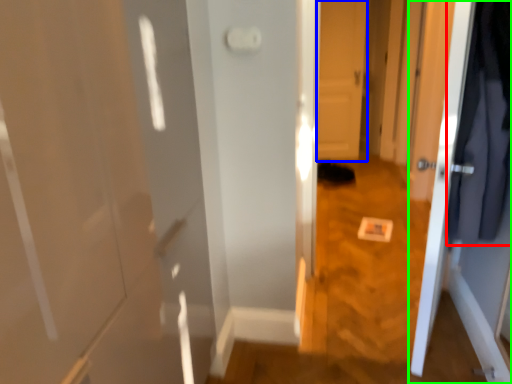
Question: Based on their relative distances, which object is nearer to clothing (highlighted by a red box)? Choose from door (highlighted by a blue box) and door (highlighted by a green box).

Choices:
 (A) door
 (B) door

Answer: (B)